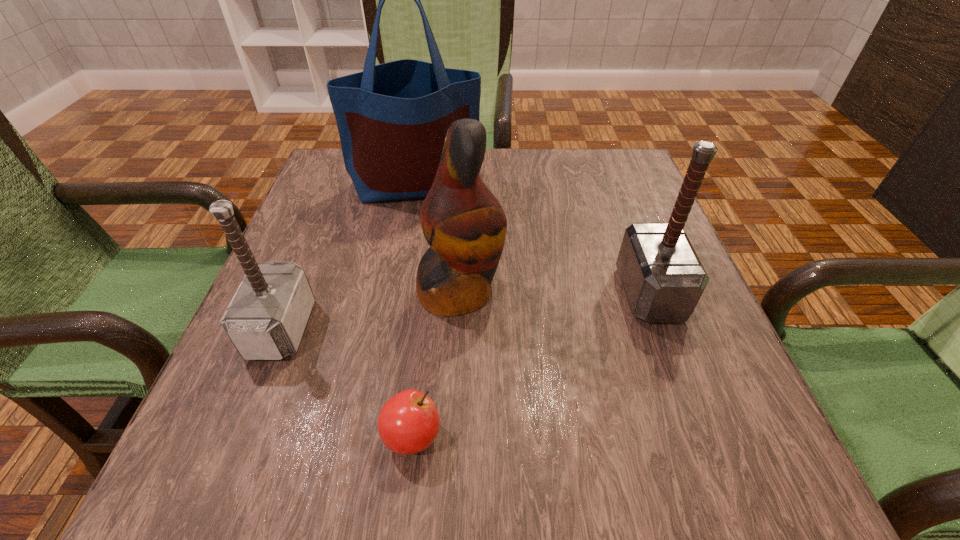
Identify the location of free space located for striking with the head of the left hammer. (404, 328).

At what (x,y) coordinates should I click in order to perform the action: click on vacant space located 0.150m on the back of the shortest object. Please return your answer as a coordinate pair (x, y). Looking at the image, I should click on (424, 332).

Where is `object that is at the far edge`? object that is at the far edge is located at coordinates (392, 118).

Where is `object present at the near edge`? This screenshot has width=960, height=540. object present at the near edge is located at coordinates (408, 423).

The height and width of the screenshot is (540, 960). Find the location of `handbag that is at the left edge`. handbag that is at the left edge is located at coordinates (392, 118).

What are the coordinates of `hammer located in the left edge section of the desktop` in the screenshot? It's located at (265, 320).

This screenshot has width=960, height=540. Identify the location of object that is at the right edge. (663, 278).

Locate an element on the screen. This screenshot has width=960, height=540. object present at the far left corner is located at coordinates (392, 118).

Find the location of a particular element. vacant area at the far edge is located at coordinates (555, 174).

Find the location of a particular element. The height and width of the screenshot is (540, 960). free space at the near edge of the desktop is located at coordinates (481, 487).